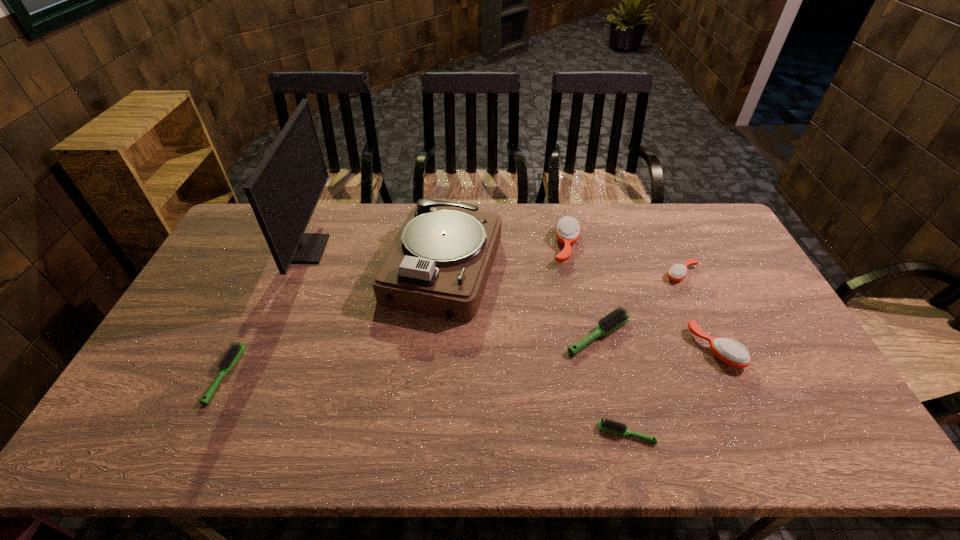
Locate an element on the screen. Image resolution: width=960 pixels, height=540 pixels. object identified as the closest to the smallest orange hairbrush is located at coordinates (728, 351).

Image resolution: width=960 pixels, height=540 pixels. Find the location of `hairbrush that is the closest to the biggest light hairbrush`. hairbrush that is the closest to the biggest light hairbrush is located at coordinates (728, 351).

Image resolution: width=960 pixels, height=540 pixels. Identify the location of hairbrush that stands as the second closest to the tallest hairbrush. (677, 272).

Select which orange hairbrush appears as the closest to the nearest object. Please provide its 2D coordinates. Your answer should be formatted as a tuple, i.e. [(x, y)], where the tuple contains the x and y coordinates of a point satisfying the conditions above.

[(728, 351)]

At what (x,y) coordinates should I click in order to perform the action: click on the third closest orange hairbrush to the tallest object. Please return your answer as a coordinate pair (x, y). This screenshot has width=960, height=540. Looking at the image, I should click on pyautogui.click(x=677, y=272).

Find the location of a particular element. This screenshot has width=960, height=540. light hairbrush identified as the third closest to the third tallest object is located at coordinates (233, 353).

Choose which light hairbrush is the nearest neighbor to the nearest light hairbrush. Please provide its 2D coordinates. Your answer should be formatted as a tuple, i.e. [(x, y)], where the tuple contains the x and y coordinates of a point satisfying the conditions above.

[(615, 319)]

In order to click on vacant space that satisfies the following two spatial constraints: 1. on the front side of the second shortest object; 2. on the left side of the shortest object in this screenshot , I will do `click(199, 433)`.

Identify the location of vacant space that satisfies the following two spatial constraints: 1. on the back side of the record player; 2. on the front-facing side of the tallest object. (444, 249).